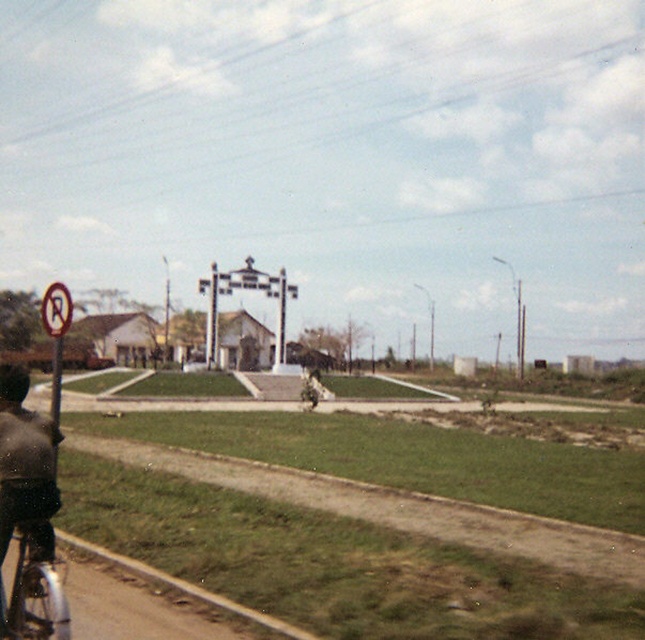
Question: Is silver metallic bicycle at lower left to the left of white plastic no parking sign at left from the viewer's perspective?

Choices:
 (A) no
 (B) yes

Answer: (A)

Question: Which of the following is the closest to the observer?

Choices:
 (A) silver metallic bicycle at lower left
 (B) white plastic no parking sign at left

Answer: (A)

Question: Where is silver metallic bicycle at lower left located in relation to white plastic no parking sign at left in the image?

Choices:
 (A) right
 (B) left

Answer: (A)

Question: Is silver metallic bicycle at lower left positioned at the back of white plastic no parking sign at left?

Choices:
 (A) no
 (B) yes

Answer: (A)